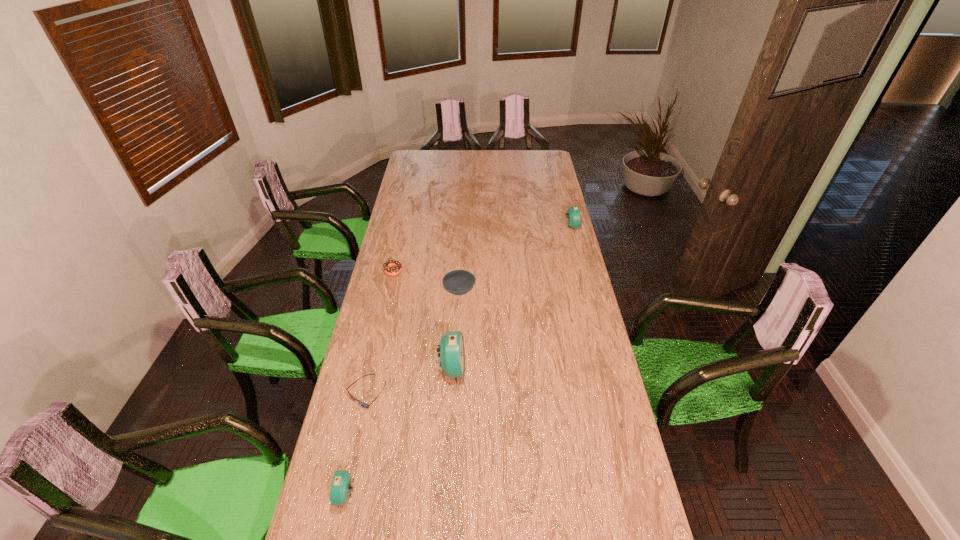
In order to click on vacant space that satisfies the following two spatial constraints: 1. on the front-facing side of the tallest object; 2. at the front of the sunglasses showing the lenses in this screenshot , I will do `click(450, 394)`.